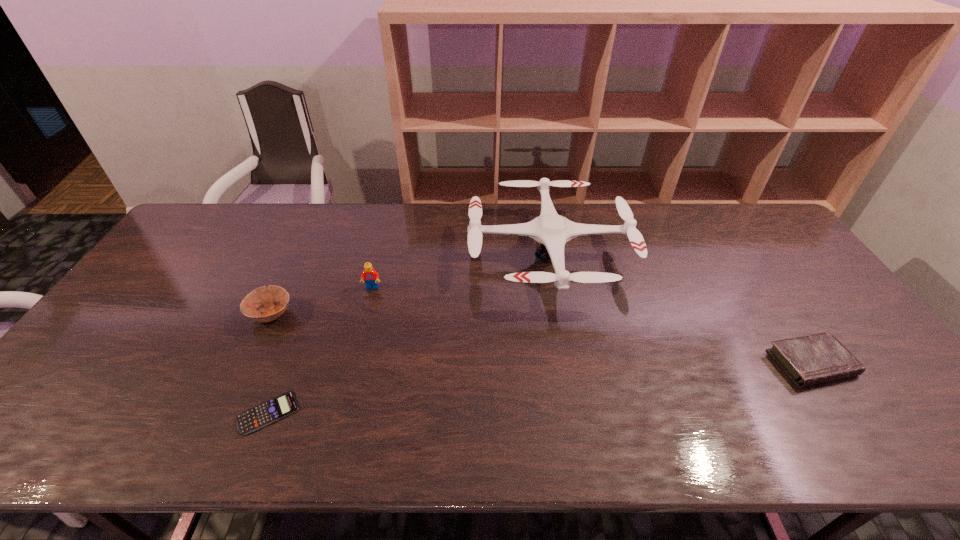
Image resolution: width=960 pixels, height=540 pixels. I want to click on blank area located on the face of the third object from left to right, so click(x=354, y=357).

You are a GUI agent. You are given a task and a screenshot of the screen. Output one action in this format:
    pyautogui.click(x=<x>, y=<y>)
    Task: Click on the free space located on the back of the bowl
    This screenshot has height=540, width=960.
    Given the screenshot: What is the action you would take?
    pyautogui.click(x=312, y=226)

What are the coordinates of `blank space located 0.060m on the right of the second nearest object` in the screenshot? It's located at (874, 363).

Locate an element on the screen. blank space located on the left of the shortest object is located at coordinates (179, 413).

You are a GUI agent. You are given a task and a screenshot of the screen. Output one action in this format:
    pyautogui.click(x=<x>, y=<y>)
    Task: Click on the object present at the far edge
    
    Given the screenshot: What is the action you would take?
    pyautogui.click(x=553, y=231)

Identify the location of object situated at the near edge. (270, 411).

Locate an element on the screen. object located at the right edge is located at coordinates (817, 358).

Locate an element on the screen. Image resolution: width=960 pixels, height=540 pixels. vacant region at the far edge of the desktop is located at coordinates (364, 206).

Identify the location of vacant region at the near edge of the desktop. This screenshot has width=960, height=540. (640, 416).

In order to click on blank area at the right edge in this screenshot , I will do (x=805, y=287).